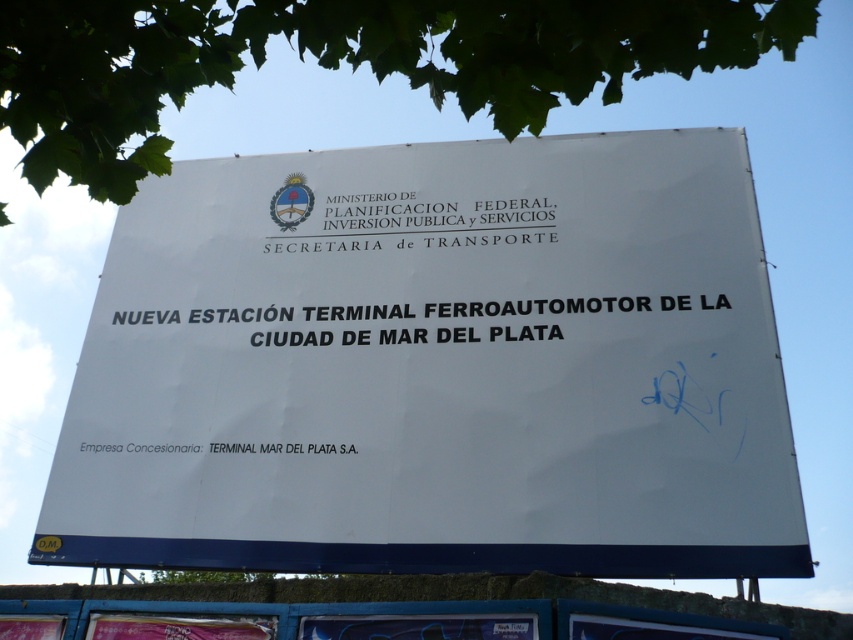
Is green leafy tree at upper center closer to the viewer compared to black text at center?

Yes, it is in front of black text at center.

This screenshot has width=853, height=640. Identify the location of green leafy tree at upper center. (341, 60).

Where is `green leafy tree at upper center`? The height and width of the screenshot is (640, 853). green leafy tree at upper center is located at coordinates (341, 60).

Who is higher up, black text at center or white paper at upper center?

white paper at upper center is higher up.

How distant is black text at center from white paper at upper center?

16.25 inches

Does point (492, 316) lie behind point (407, 211)?

No, it is not.

Where is `black text at center`? black text at center is located at coordinates (570, 307).

Between point (149, 362) and point (289, 312), which one is positioned behind?

The point (289, 312) is behind.

Can you confirm if white paper sign at center is thinner than black text at center?

No, white paper sign at center is not thinner than black text at center.

Is point (671, 426) positioned after point (450, 307)?

No, (671, 426) is in front of (450, 307).

You are a GUI agent. You are given a task and a screenshot of the screen. Output one action in this format:
    pyautogui.click(x=<x>, y=<y>)
    Task: Click on the white paper sign at center
    The width and height of the screenshot is (853, 640).
    Given the screenshot: What is the action you would take?
    point(436,368)